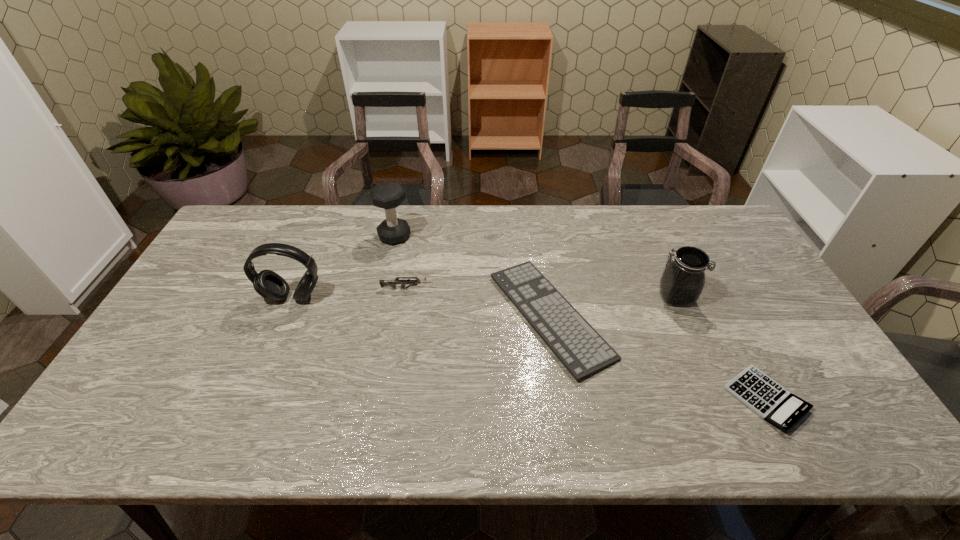
This screenshot has height=540, width=960. I want to click on free space located on the lid of the third tallest object, so click(629, 297).

The width and height of the screenshot is (960, 540). I want to click on free point located 0.060m aimed along the barrel of the gun, so click(x=454, y=289).

Where is `free region located 0.230m on the right of the computer keyboard`? free region located 0.230m on the right of the computer keyboard is located at coordinates (689, 315).

At what (x,y) coordinates should I click in order to perform the action: click on free space located on the left of the calculator. Please return your answer as a coordinate pair (x, y). Looking at the image, I should click on (675, 399).

Locate an element on the screen. The width and height of the screenshot is (960, 540). object that is at the far edge is located at coordinates (388, 195).

Find the location of a particular element. object situated at the near edge is located at coordinates (768, 399).

Find the location of a particular element. The width and height of the screenshot is (960, 540). object that is at the right edge is located at coordinates (768, 399).

The width and height of the screenshot is (960, 540). In order to click on object that is at the near right corner in this screenshot , I will do (x=768, y=399).

Where is `blank space at the far edge of the desktop`? The width and height of the screenshot is (960, 540). blank space at the far edge of the desktop is located at coordinates (662, 240).

In order to click on vacant space at the near edge in this screenshot , I will do `click(506, 416)`.